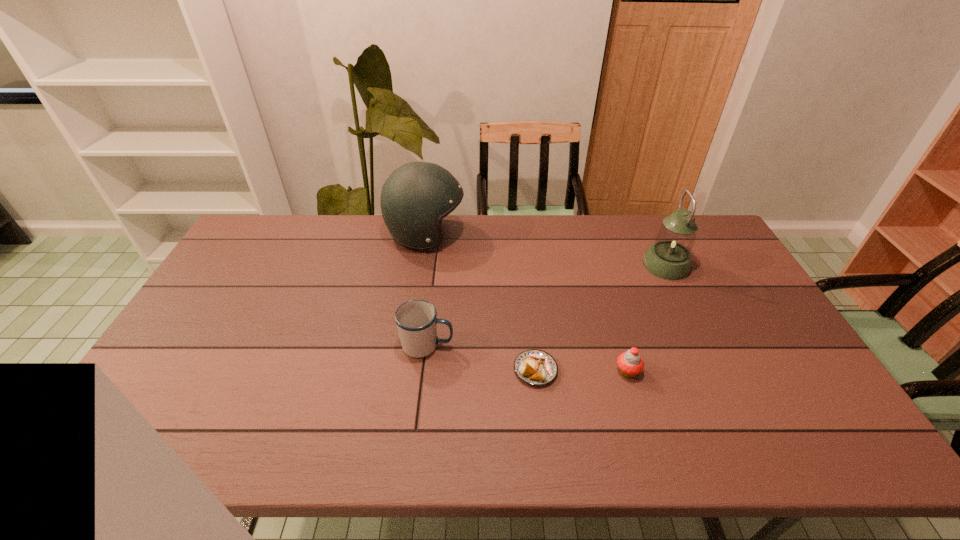
Find the location of `free location that satisfies the following two spatial constraints: 1. on the front side of the lantern; 2. on the handle side of the third shortest object`. free location that satisfies the following two spatial constraints: 1. on the front side of the lantern; 2. on the handle side of the third shortest object is located at coordinates (705, 345).

Locate an element on the screen. vacant point that satisfies the following two spatial constraints: 1. on the handle side of the mug; 2. on the back side of the third object from left to right is located at coordinates (424, 370).

Find the location of a particular element. Image resolution: width=960 pixels, height=540 pixels. free location that satisfies the following two spatial constraints: 1. on the front side of the lantern; 2. on the handle side of the third tallest object is located at coordinates (705, 345).